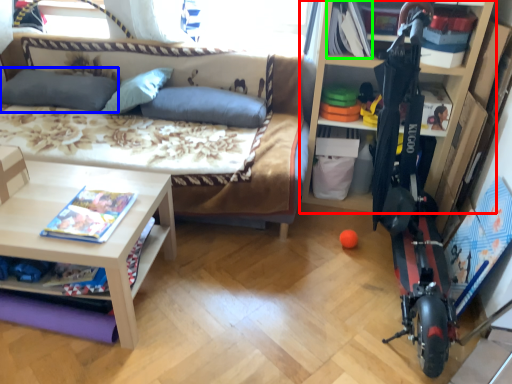
Question: Which is nearer to the shelf (highlighted by a red box)? pillow (highlighted by a blue box) or book (highlighted by a green box).

Choices:
 (A) pillow
 (B) book

Answer: (B)